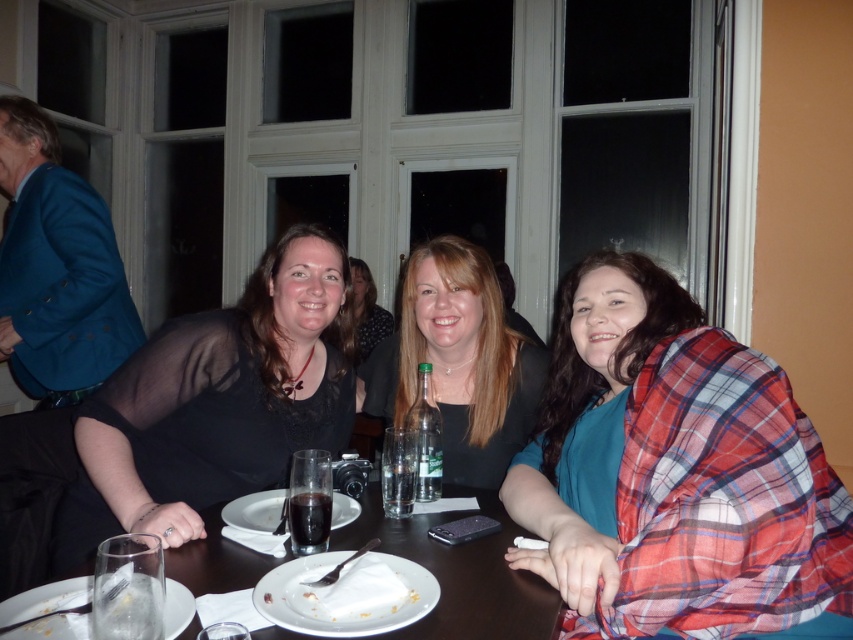
Question: Can you confirm if plaid fabric scarf at center is positioned to the right of black lace dress at center?

Choices:
 (A) yes
 (B) no

Answer: (A)

Question: Can you confirm if smooth wooden table at center is positioned below white ceramic plate at center?

Choices:
 (A) no
 (B) yes

Answer: (B)

Question: Estimate the real-world distances between objects in this image. Which object is farther from the white ceramic plate at lower left?

Choices:
 (A) white matte plate at center
 (B) black lace dress at center

Answer: (B)

Question: Which object is farther from the camera taking this photo?

Choices:
 (A) white matte plate at center
 (B) smooth wooden table at center
 (C) white ceramic plate at center
 (D) plaid fabric scarf at center

Answer: (C)

Question: Is black lace dress at center above white matte plate at center?

Choices:
 (A) yes
 (B) no

Answer: (A)

Question: Which point is closer to the camera?

Choices:
 (A) white ceramic plate at center
 (B) black lace dress at center
 (C) white matte plate at center

Answer: (C)